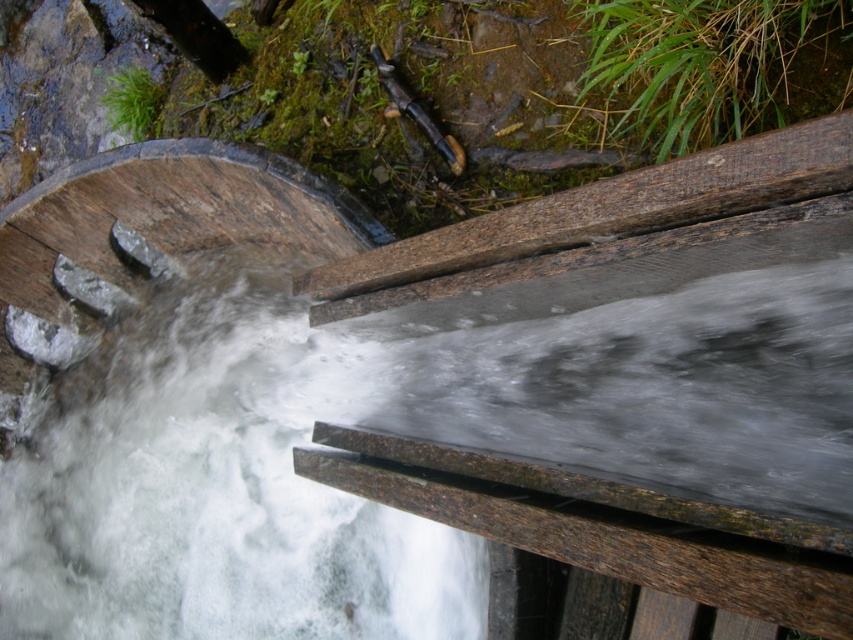
Question: Where is clear water at center located in relation to brown wood rail at center in the image?

Choices:
 (A) below
 (B) above

Answer: (A)

Question: Does clear water at center appear on the left side of brown wood rail at center?

Choices:
 (A) yes
 (B) no

Answer: (A)

Question: Is clear water at center above brown wood rail at center?

Choices:
 (A) yes
 (B) no

Answer: (B)

Question: Which point is closer to the camera?

Choices:
 (A) brown wood rail at center
 (B) clear water at center

Answer: (A)